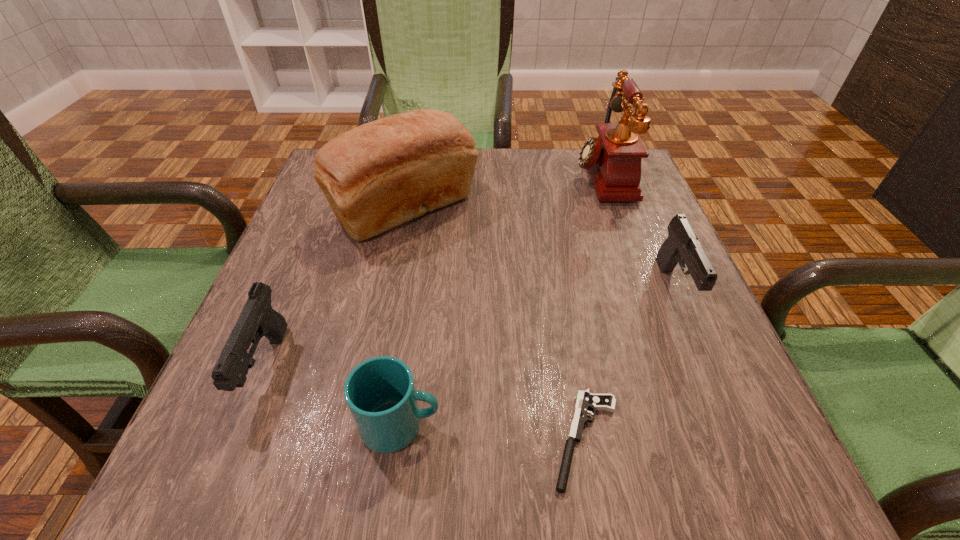
This screenshot has height=540, width=960. Identify the location of blank space at the left edge of the desktop. (308, 366).

In the image, there is a desktop. At what (x,y) coordinates should I click in order to perform the action: click on vacant space at the right edge. Please return your answer as a coordinate pair (x, y). The height and width of the screenshot is (540, 960). Looking at the image, I should click on (654, 314).

Identify the location of vacant region at the far left corner. Image resolution: width=960 pixels, height=540 pixels. (305, 199).

Identify the location of vacant region at the near right corner of the desktop. (678, 449).

Where is `vacant point located between the telephone and the rightmost pistol`? Image resolution: width=960 pixels, height=540 pixels. vacant point located between the telephone and the rightmost pistol is located at coordinates (637, 232).

This screenshot has height=540, width=960. In order to click on vacant space that is in between the telephone and the leftmost pistol in this screenshot , I will do `click(434, 272)`.

You are a GUI agent. You are given a task and a screenshot of the screen. Output one action in this format:
    pyautogui.click(x=<x>, y=<y>)
    Task: Click on the vacant point located between the leftmost pistol and the rightmost pistol
    Image resolution: width=960 pixels, height=540 pixels.
    Given the screenshot: What is the action you would take?
    pyautogui.click(x=470, y=328)

What are the coordinates of `vacant point located between the cup and the telephone` in the screenshot? It's located at (501, 300).

This screenshot has height=540, width=960. What are the coordinates of `vacant space that's between the third farthest object and the cup` in the screenshot? It's located at tap(538, 357).

What are the coordinates of `free space between the bread and the cup` in the screenshot? It's located at (403, 318).